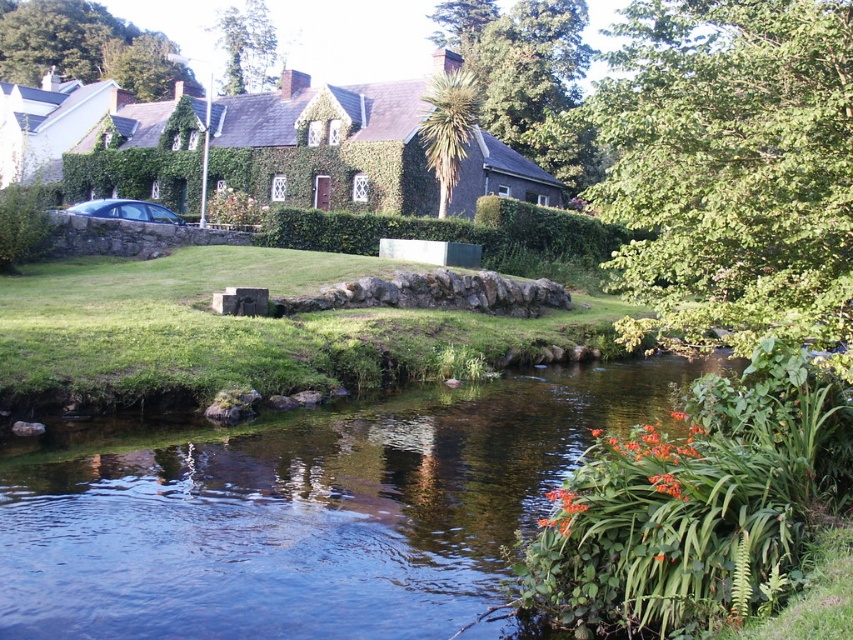
Question: Which object is the closest to the satin black car at left?

Choices:
 (A) green leafy hedge at center
 (B) clear water at lower center

Answer: (A)

Question: Does green leafy hedge at center have a smaller size compared to satin black car at left?

Choices:
 (A) yes
 (B) no

Answer: (B)

Question: Can you confirm if green leafy hedge at center is positioned below satin black car at left?

Choices:
 (A) yes
 (B) no

Answer: (A)

Question: Is clear water at lower center thinner than green leafy hedge at center?

Choices:
 (A) no
 (B) yes

Answer: (B)

Question: Which of these objects is positioned farthest from the satin black car at left?

Choices:
 (A) clear water at lower center
 (B) green leafy hedge at center

Answer: (A)

Question: Considering the real-world distances, which object is farthest from the green leafy hedge at center?

Choices:
 (A) clear water at lower center
 (B) satin black car at left

Answer: (A)